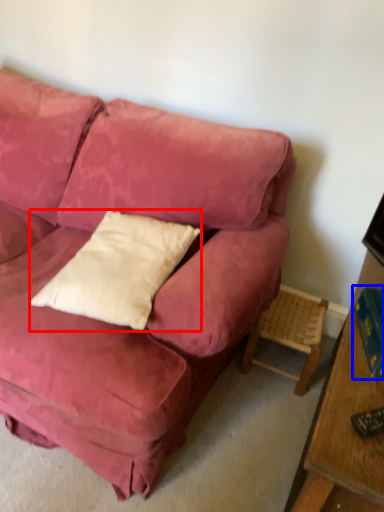
Question: Which object is further to the camera taking this photo, pillow (highlighted by a red box) or book (highlighted by a blue box)?

Choices:
 (A) pillow
 (B) book

Answer: (B)